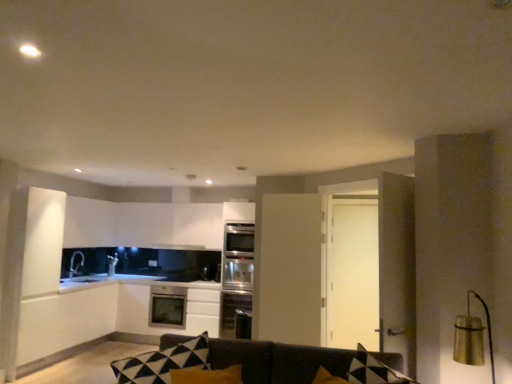
Question: Is satin silver dishwasher at center wider than satin black microwave at center?

Choices:
 (A) no
 (B) yes

Answer: (B)

Question: From the image's perspective, is satin silver dishwasher at center on top of satin black microwave at center?

Choices:
 (A) no
 (B) yes

Answer: (A)

Question: Would you say satin silver dishwasher at center is a long distance from satin black microwave at center?

Choices:
 (A) yes
 (B) no

Answer: (B)

Question: Is satin silver dishwasher at center positioned before satin black microwave at center?

Choices:
 (A) yes
 (B) no

Answer: (A)

Question: Is satin silver dishwasher at center not inside satin black microwave at center?

Choices:
 (A) no
 (B) yes

Answer: (B)

Question: From the image's perspective, does satin silver dishwasher at center appear lower than satin black microwave at center?

Choices:
 (A) yes
 (B) no

Answer: (A)

Question: Can you confirm if satin silver dishwasher at center is thinner than satin silver oven at center?

Choices:
 (A) yes
 (B) no

Answer: (B)

Question: From a real-world perspective, is satin silver dishwasher at center positioned under satin silver oven at center based on gravity?

Choices:
 (A) yes
 (B) no

Answer: (A)

Question: Can you confirm if satin silver dishwasher at center is wider than satin silver oven at center?

Choices:
 (A) no
 (B) yes

Answer: (B)

Question: Considering the relative positions of satin silver dishwasher at center and satin silver oven at center in the image provided, is satin silver dishwasher at center in front of satin silver oven at center?

Choices:
 (A) yes
 (B) no

Answer: (B)

Question: Considering the relative positions of satin silver dishwasher at center and satin silver oven at center in the image provided, is satin silver dishwasher at center behind satin silver oven at center?

Choices:
 (A) yes
 (B) no

Answer: (A)

Question: Considering the relative positions of satin silver dishwasher at center and satin silver oven at center in the image provided, is satin silver dishwasher at center to the left of satin silver oven at center from the viewer's perspective?

Choices:
 (A) yes
 (B) no

Answer: (A)

Question: Can you confirm if gold metallic lampshade at right is positioned to the left of black matte exhaust hood at upper center?

Choices:
 (A) yes
 (B) no

Answer: (B)